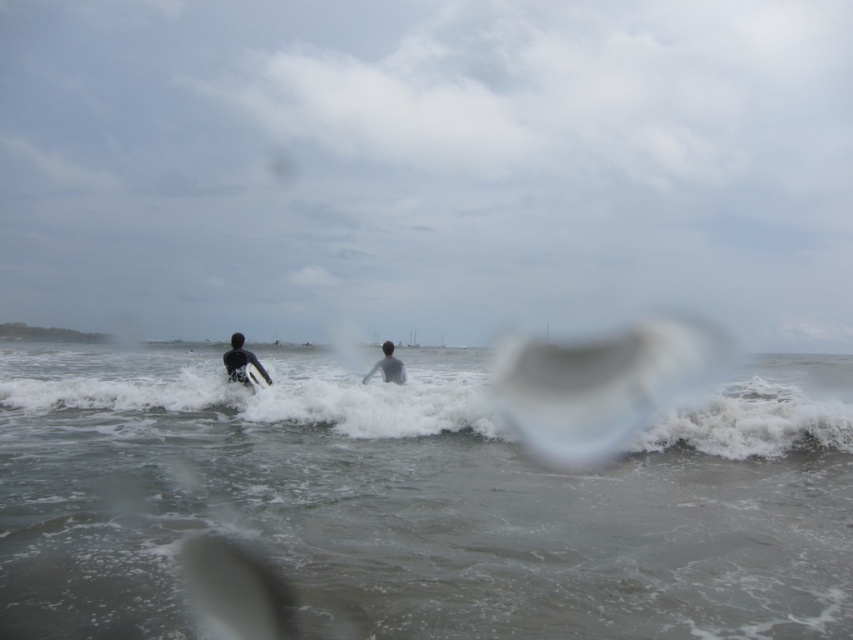
Does gray matte water at center come in front of dark gray wetsuit at center?

That is True.

Which is behind, point (693, 572) or point (393, 358)?

The point (393, 358) is behind.

Identify the location of gray matte water at center. (416, 500).

Is point (231, 349) positioned in front of point (256, 380)?

No, it is behind (256, 380).

This screenshot has height=640, width=853. What are the coordinates of `dark gray wetsuit at left` in the screenshot? It's located at (241, 362).

Does dark gray wetsuit at center have a greater height compared to white foam surfboard at center?

Yes.

Is dark gray wetsuit at center in front of white foam surfboard at center?

No.

Find the location of `dark gray wetsuit at center`. dark gray wetsuit at center is located at coordinates (387, 365).